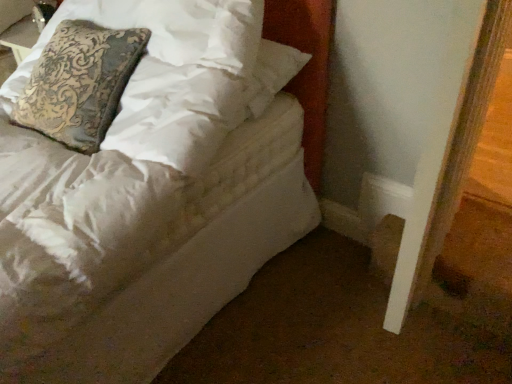
Where is `silky satin pillow at upper left`? silky satin pillow at upper left is located at coordinates (79, 83).

What do you see at coordinates (79, 83) in the screenshot?
I see `silky satin pillow at upper left` at bounding box center [79, 83].

Find the location of a particular element. This screenshot has width=512, height=384. silky satin pillow at upper left is located at coordinates (79, 83).